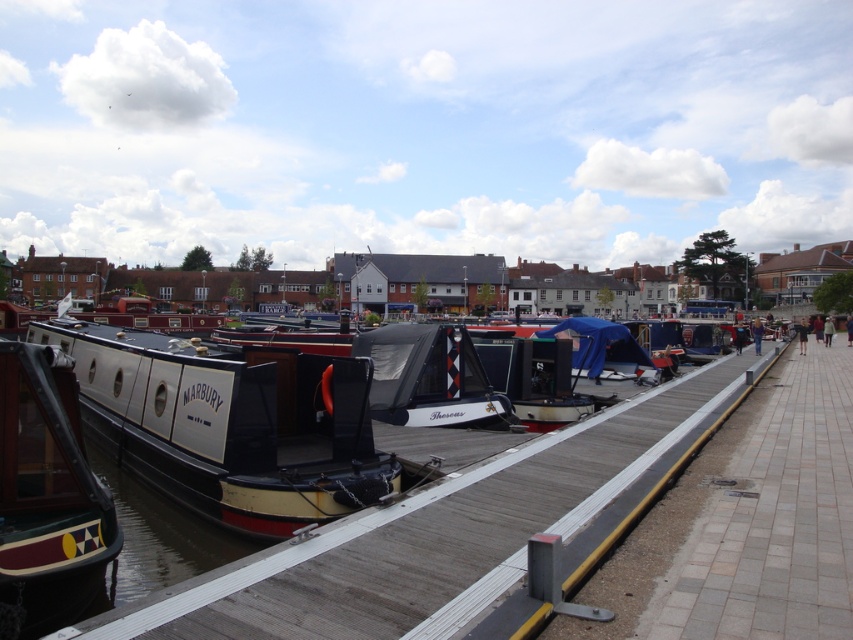
Is wooden dock at center closer to camera compared to maroon glossy boat at left?

Yes, it is.

Which is in front, point (582, 472) or point (33, 515)?

Point (33, 515)

Who is more distant from viewer, (374, 634) or (71, 392)?

The point (71, 392) is more distant.

You are a GUI agent. You are given a task and a screenshot of the screen. Output one action in this format:
    pyautogui.click(x=<x>, y=<y>)
    Task: Click on the wooden dock at center
    This screenshot has width=853, height=640.
    Given the screenshot: What is the action you would take?
    pyautogui.click(x=438, y=532)

Is black polished wood boat at left further to the viewer compared to maroon glossy boat at left?

Yes, black polished wood boat at left is further from the viewer.

Is black polished wood boat at left bigger than maroon glossy boat at left?

Correct, black polished wood boat at left is larger in size than maroon glossy boat at left.

Based on the photo, measure the distance between point [283,474] and camera.

Point [283,474] is 8.09 meters away from camera.

I want to click on black polished wood boat at left, so click(229, 424).

Can you confirm if wooden dock at center is smaller than black canvas boat at center?

Incorrect, wooden dock at center is not smaller in size than black canvas boat at center.

Based on the photo, which is more to the right, wooden dock at center or black canvas boat at center?

wooden dock at center

Between point (630, 422) and point (426, 324), which one is positioned behind?

The point (426, 324) is behind.

This screenshot has height=640, width=853. I want to click on wooden dock at center, so click(438, 532).